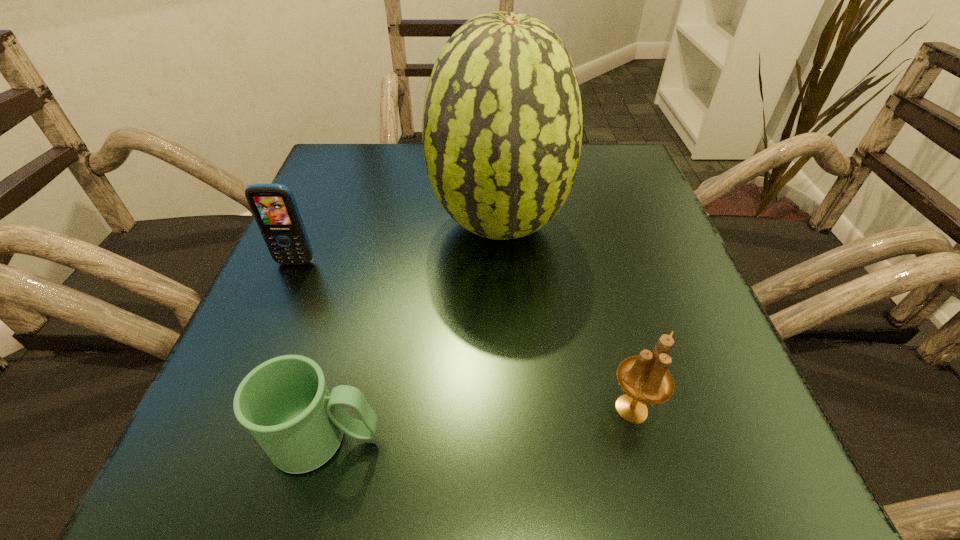
You are a GUI agent. You are given a task and a screenshot of the screen. Output one action in this format:
    pyautogui.click(x=<x>, y=<y>)
    Task: Click on the candle holder located in the near edge section of the desktop
    The image size is (960, 540).
    Given the screenshot: What is the action you would take?
    pyautogui.click(x=645, y=379)

At what (x,y) coordinates should I click in order to perform the action: click on mug that is at the near edge. Please return your answer as a coordinate pair (x, y). The image size is (960, 540). Looking at the image, I should click on (284, 402).

The width and height of the screenshot is (960, 540). Find the location of `cellular telephone that is at the left edge`. cellular telephone that is at the left edge is located at coordinates (274, 207).

In order to click on mug at the left edge in this screenshot , I will do `click(284, 402)`.

Locate an element on the screen. object present at the right edge is located at coordinates (645, 379).

Find the location of a particular element. This screenshot has height=540, width=960. object present at the near left corner is located at coordinates (284, 402).

Find the location of a particular element. Image resolution: width=960 pixels, height=540 pixels. object that is at the near right corner is located at coordinates 645,379.

Identify the location of vacant point at the near edge. (376, 462).

Find the location of a particular element. Image resolution: width=960 pixels, height=540 pixels. blank space at the left edge is located at coordinates (274, 336).

In the image, there is a desktop. At what (x,y) coordinates should I click in order to perform the action: click on vacant space at the right edge. Please return your answer as a coordinate pair (x, y). Looking at the image, I should click on (593, 225).